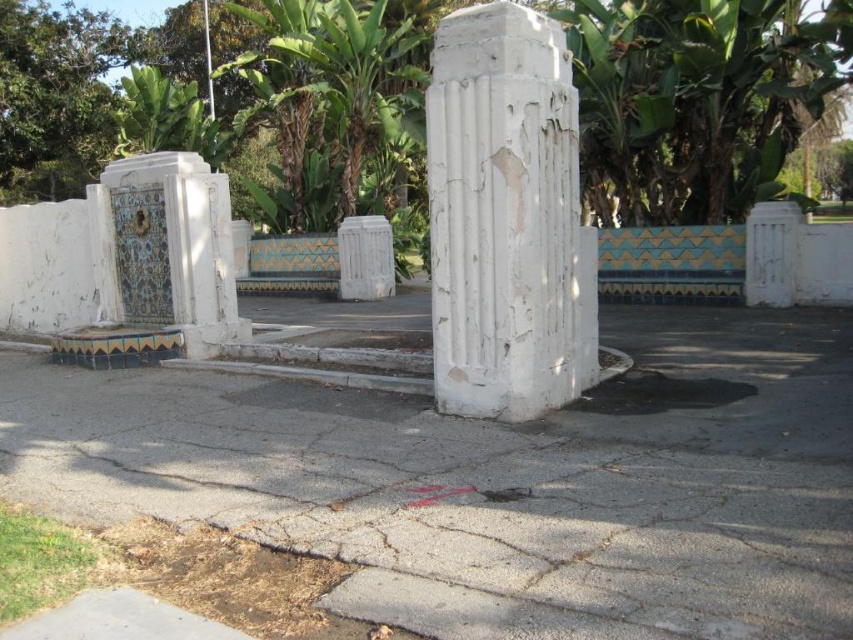
Is gray asphalt pavement at center wider than white cracked concrete column at center?

Yes.

Is gray asphalt pavement at center smaller than white cracked concrete column at center?

Incorrect, gray asphalt pavement at center is not smaller in size than white cracked concrete column at center.

Locate an element on the screen. This screenshot has height=640, width=853. gray asphalt pavement at center is located at coordinates (500, 481).